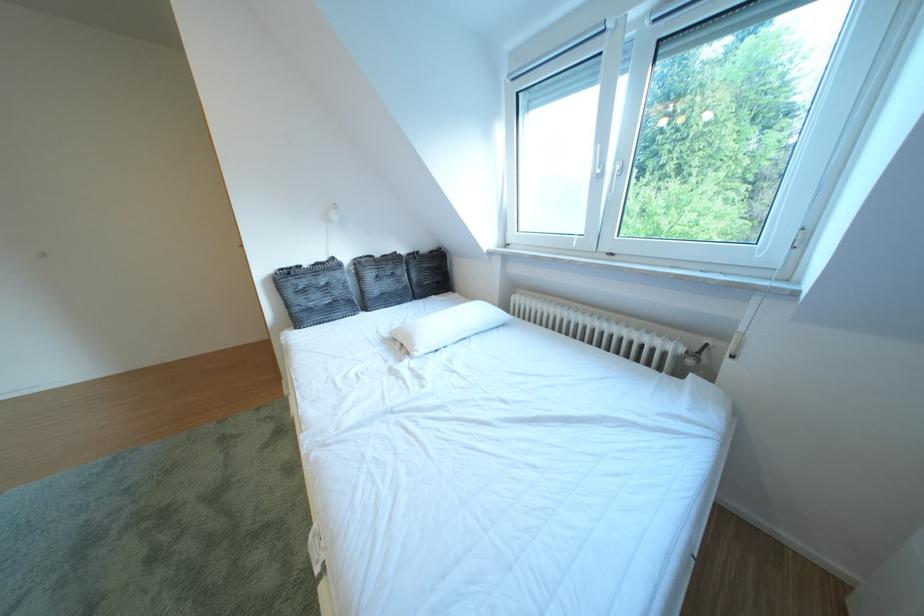
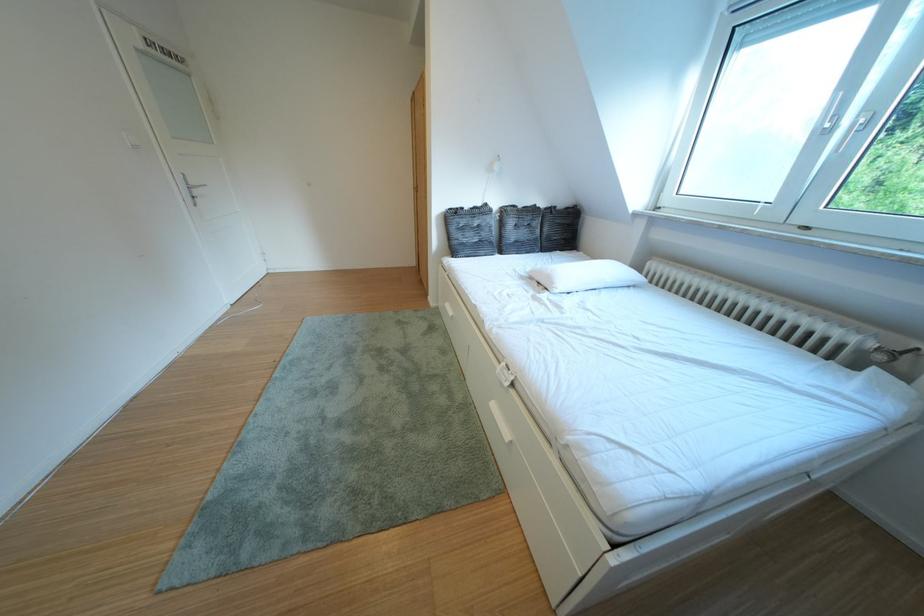
Locate, in the second image, the point that corresponds to the point at 427,350 in the first image.

(565, 288)